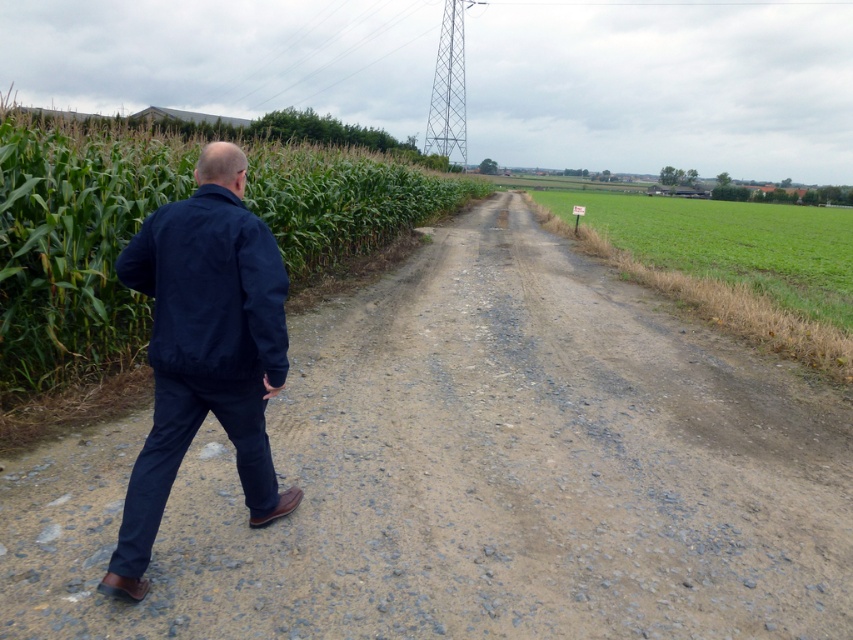
Between point (138, 157) and point (184, 250), which one is positioned behind?

Point (138, 157)

Can you confirm if green leafy corn at left is thinner than navy blue jacket at left?

No.

Find the location of a particular element. Image resolution: width=853 pixels, height=640 pixels. green leafy corn at left is located at coordinates (76, 243).

Is dull gray gravel at center above metallic tower at upper center?

No, dull gray gravel at center is not above metallic tower at upper center.

Is dull gray gravel at center to the right of metallic tower at upper center from the viewer's perspective?

Yes, dull gray gravel at center is to the right of metallic tower at upper center.

What are the coordinates of `dull gray gravel at center` in the screenshot? It's located at (473, 474).

Image resolution: width=853 pixels, height=640 pixels. In order to click on dull gray gravel at center in this screenshot , I will do `click(473, 474)`.

Is dull gray gravel at center in front of green grassy field at center?

That is True.

Looking at this image, who is lower down, dull gray gravel at center or green grassy field at center?

dull gray gravel at center

Who is more distant from viewer, (334, 458) or (614, 244)?

Point (614, 244)

Find the location of `dull gray gravel at center`. dull gray gravel at center is located at coordinates (473, 474).